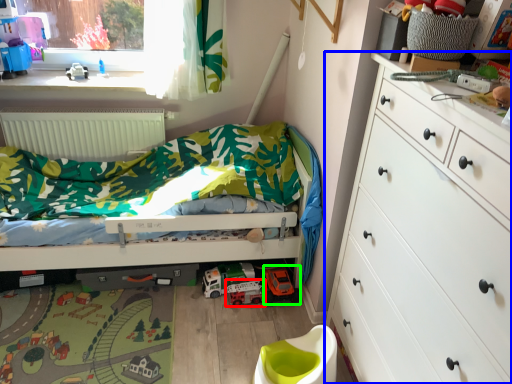
Question: Which object is positioned farthest from toy car (highlighted by a red box)? Select from chest of drawers (highlighted by a blue box) and toy (highlighted by a green box).

Choices:
 (A) chest of drawers
 (B) toy

Answer: (A)